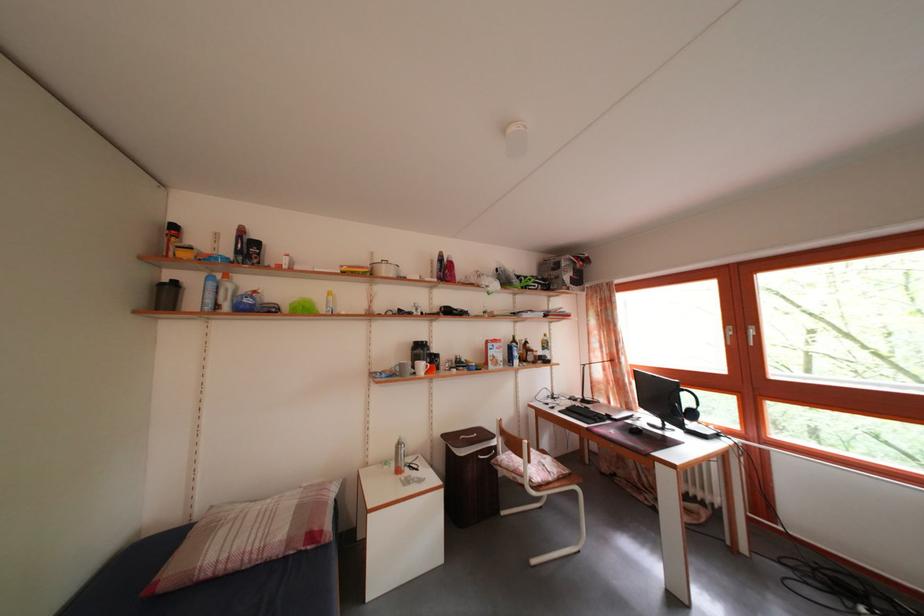
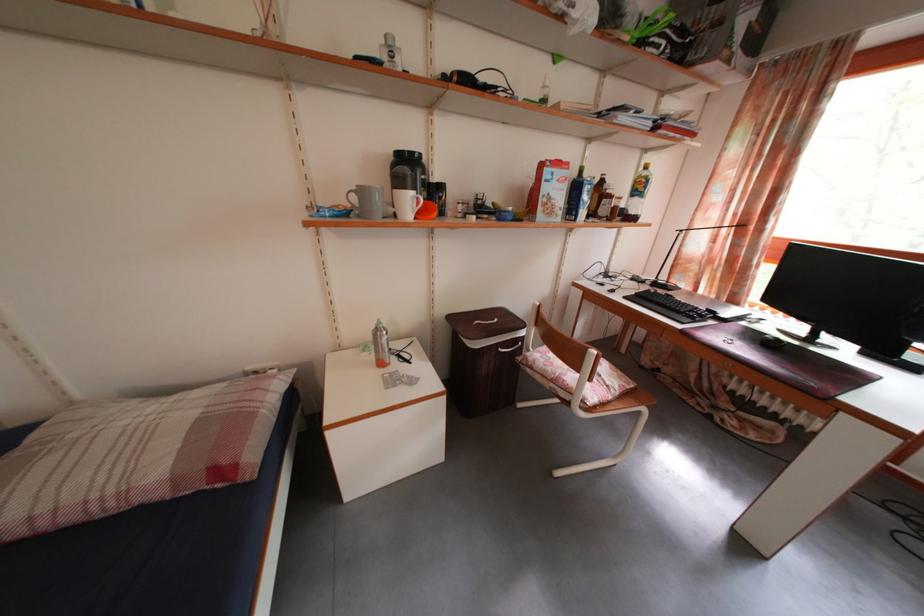
Where in the second image is the point corresponding to the point at 407,451 from the first image?

(384, 338)